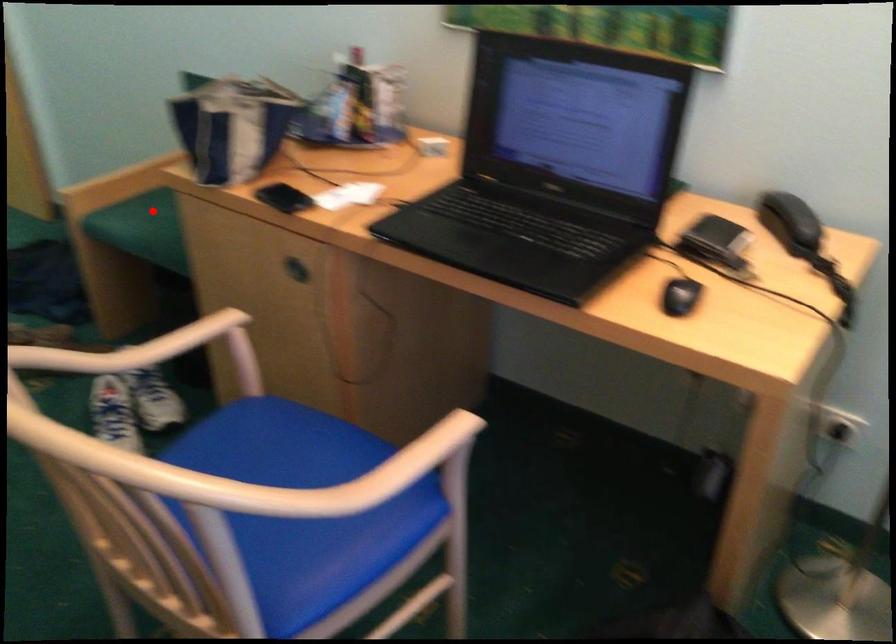
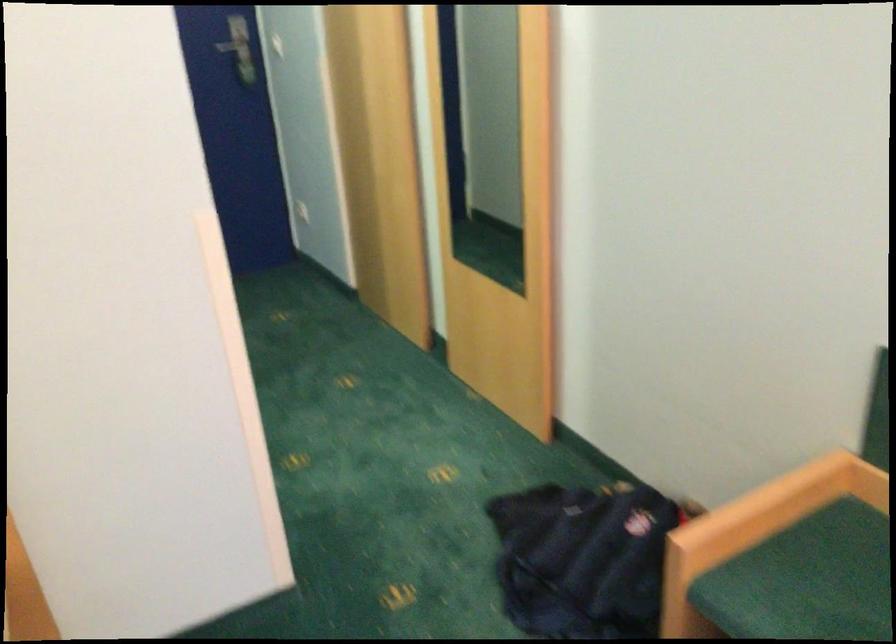
Where in the second image is the point corresponding to the highlighted location from the first image?

(806, 580)